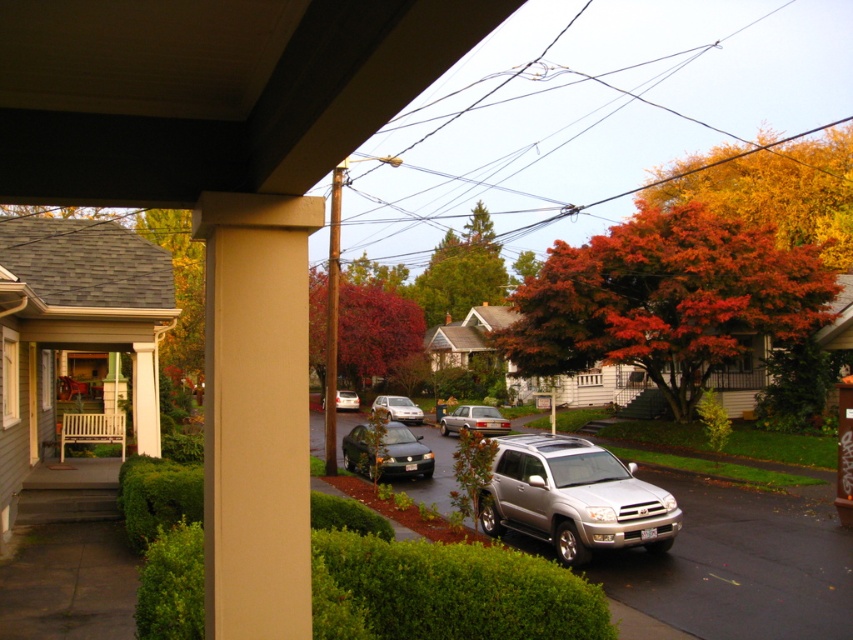
You are standing on the porch looking out. There is a point marked at coordinates (256, 412). What object is located at that point?

The point at coordinates (256, 412) marks the beige smooth column at center.

You are standing on the porch and want to place a 3.5 meter long ladder against the beige smooth column at center. Is there enough space between you and the column to safely place the ladder?

The beige smooth column at center is only 3.41 meters away from the viewer, which is slightly shorter than the 3.5 meter ladder. Therefore, there isn not enough space to safely place the ladder against the column.

You are a delivery person trying to park your van between the silver metallic suv at lower right and the silver metallic sedan at center. Can your van, which is 2 meters wide, fit in the space between them?

The silver metallic suv at lower right is thinner than the silver metallic sedan at center, but the exact width of the space between them isn